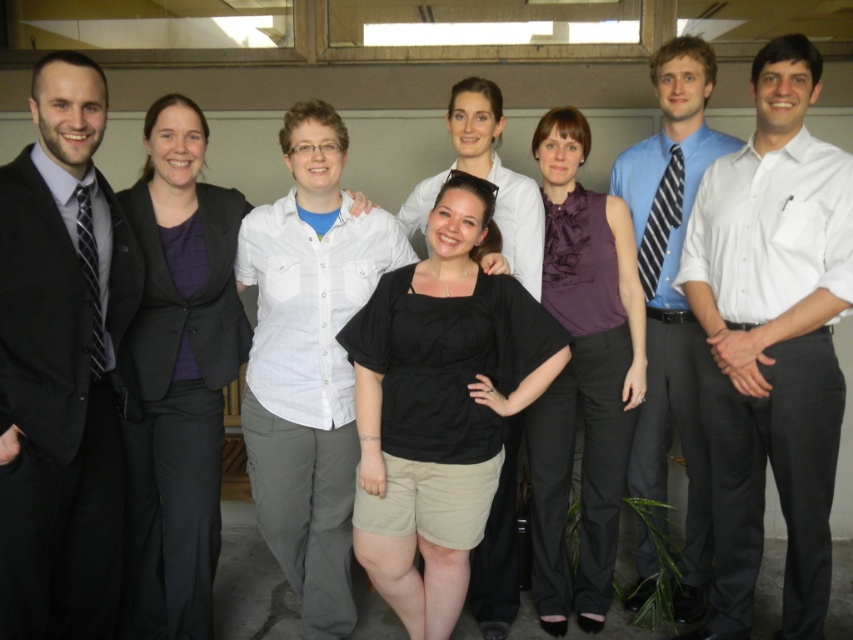
Question: Is matte black blazer at left wider than black matte shirt at center?

Choices:
 (A) no
 (B) yes

Answer: (A)

Question: Which is farther from the black suit at left?

Choices:
 (A) matte black blazer at left
 (B) black matte shirt at center
 (C) blue striped tie at center
 (D) purple satin blouse at center

Answer: (C)

Question: Which of these objects is positioned closest to the blue striped tie at center?

Choices:
 (A) matte black blazer at left
 (B) black matte shirt at center

Answer: (B)

Question: Is matte black blazer at left below purple satin blouse at center?

Choices:
 (A) yes
 (B) no

Answer: (B)

Question: Considering the relative positions of white smooth shirt at right and blue striped tie at center in the image provided, where is white smooth shirt at right located with respect to blue striped tie at center?

Choices:
 (A) below
 (B) above

Answer: (A)

Question: Which point is closer to the camera?

Choices:
 (A) purple satin blouse at center
 (B) matte black blazer at left
 (C) black matte shirt at center
 (D) blue striped tie at center

Answer: (B)